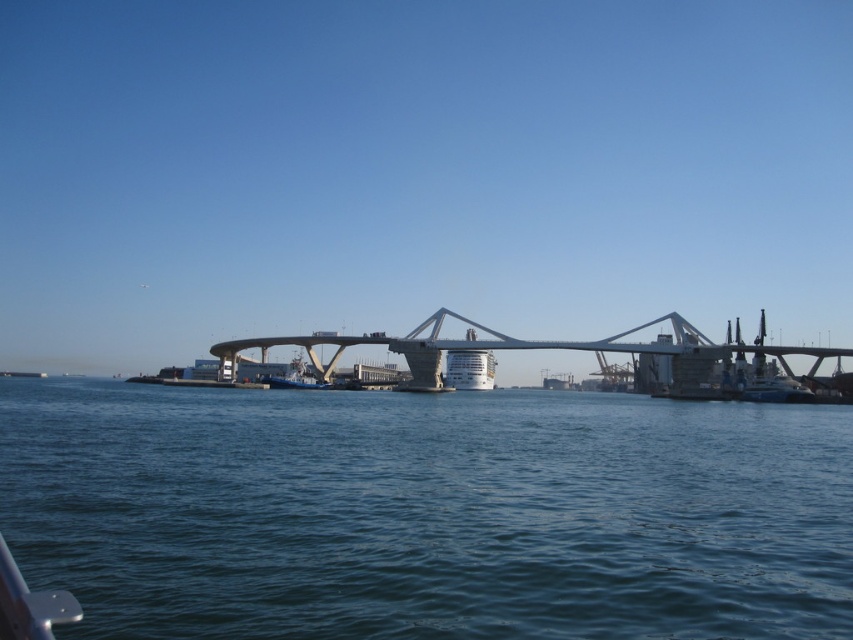
Question: Does blue water at center appear over white concrete bridge at center?

Choices:
 (A) no
 (B) yes

Answer: (A)

Question: Can you confirm if blue water at center is positioned to the right of white concrete bridge at center?

Choices:
 (A) yes
 (B) no

Answer: (B)

Question: In this image, where is blue water at center located relative to white concrete bridge at center?

Choices:
 (A) right
 (B) left

Answer: (B)

Question: Which point appears closest to the camera in this image?

Choices:
 (A) (456, 348)
 (B) (292, 616)

Answer: (B)

Question: Among these points, which one is farthest from the camera?

Choices:
 (A) (851, 632)
 (B) (445, 316)

Answer: (B)